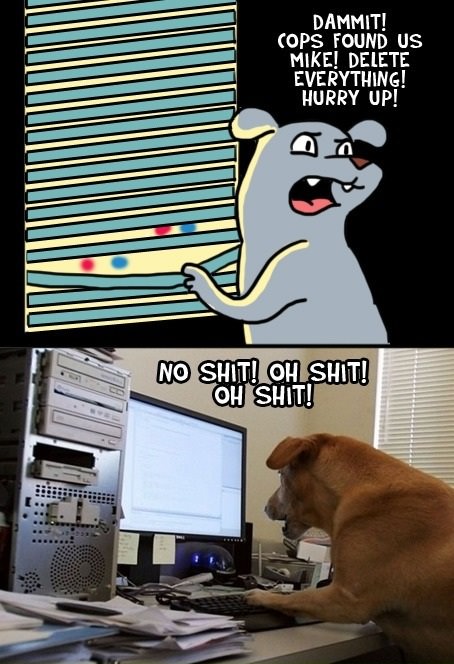
Find the location of a particular element. This screenshot has height=664, width=454. window is located at coordinates (159, 258).